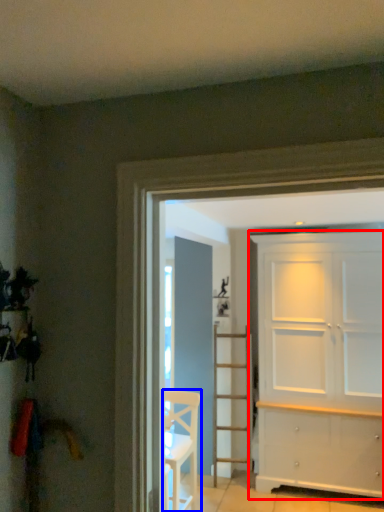
Question: Among these objects, which one is nearest to the camera, door (highlighted by a red box) or chair (highlighted by a blue box)?

Choices:
 (A) door
 (B) chair

Answer: (B)